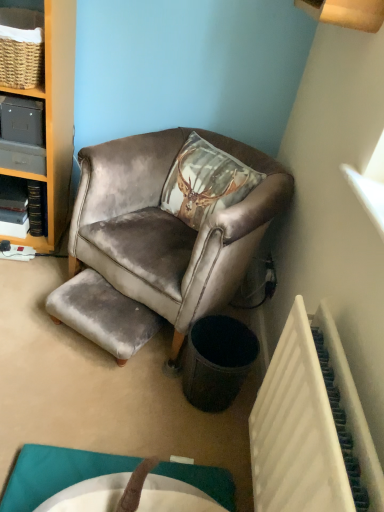
Locate an element on the screen. This screenshot has width=384, height=512. vacant area that lies in front of black textured trash bin at lower right is located at coordinates (189, 435).